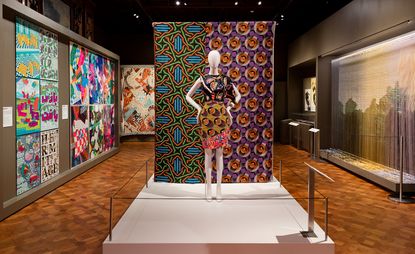
The image size is (415, 254). I want to click on ceiling, so click(x=122, y=47).